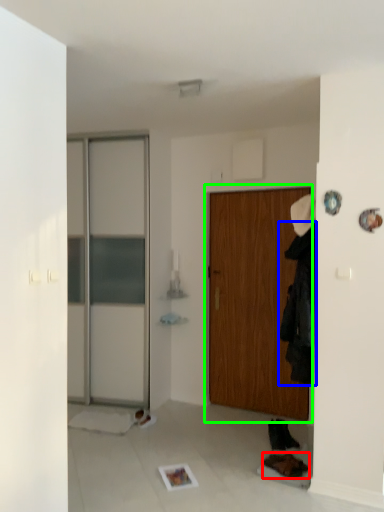
Question: Which object is positioned farthest from shoe (highlighted by a red box)? Select from clothing (highlighted by a blue box) and door (highlighted by a green box).

Choices:
 (A) clothing
 (B) door

Answer: (B)